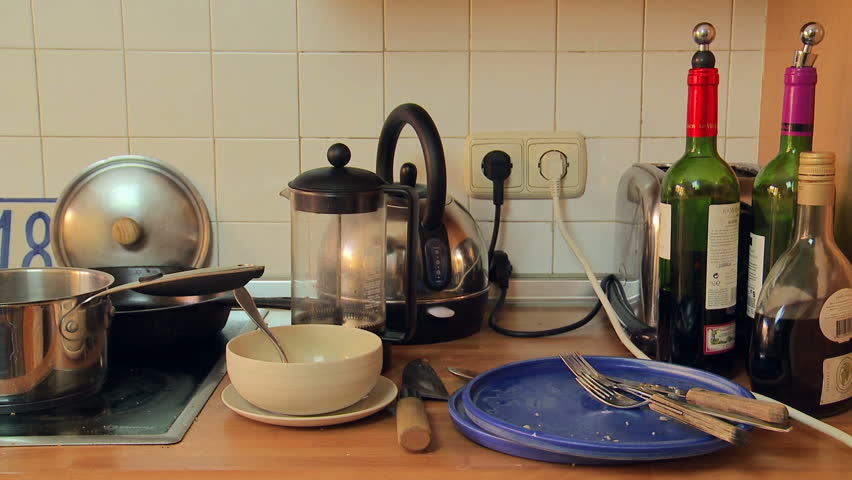
Where is `plates`? The image size is (852, 480). plates is located at coordinates click(x=556, y=418), click(x=516, y=447), click(x=372, y=407).